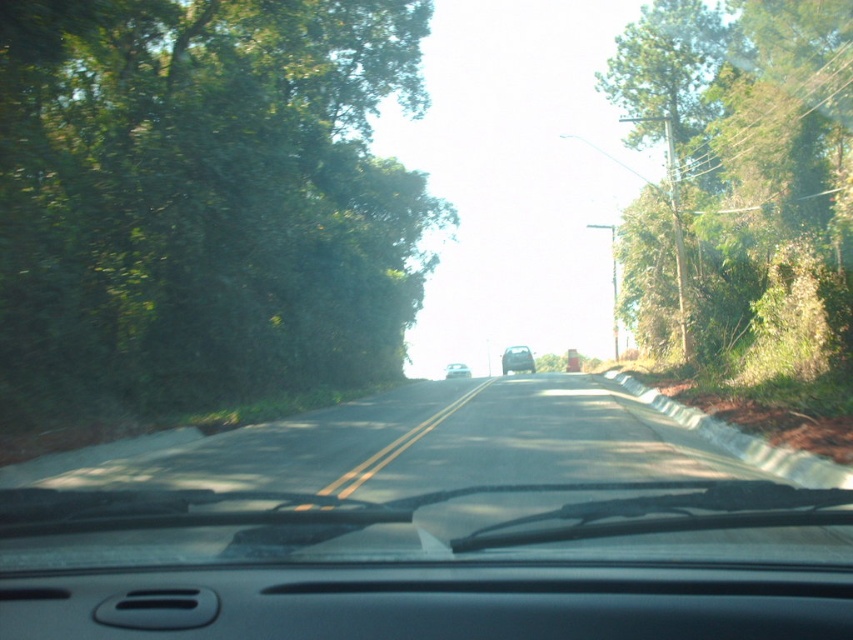
From the picture: You are driving a car with a 10 meter braking distance. You see a point at coordinates point (167, 388) in front of you. Can you safely stop before reaching that point?

The distance between point (167, 388) and the camera is 19.64 meters. Since your braking distance is 10 meters, you cannot stop in time and will collide with the point (167, 388).

From the picture: You are driving a car with a trunk length of 1.5 meters. You need to park your car between the asphalt road at center and the green leafy tree at right. Is there enough space to park your car there?

The asphalt road at center and the green leafy tree at right are 11.87 meters apart from each other, so yes, there is enough space to park your car between them since the distance is greater than the car trunk length of 1.5 meters.

You are driving a car and want to know the position of the asphalt road at center relative to the green leafy tree at right. Which side of the tree is the road located on?

The asphalt road at center is positioned on the left side of green leafy tree at right.